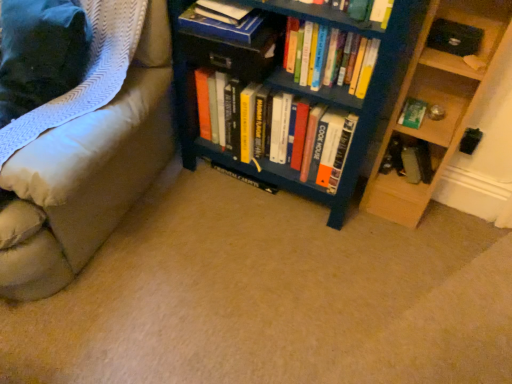
Locate an element on the screen. This screenshot has height=384, width=512. free space to the left of blue painted wood bookcase at center is located at coordinates (173, 208).